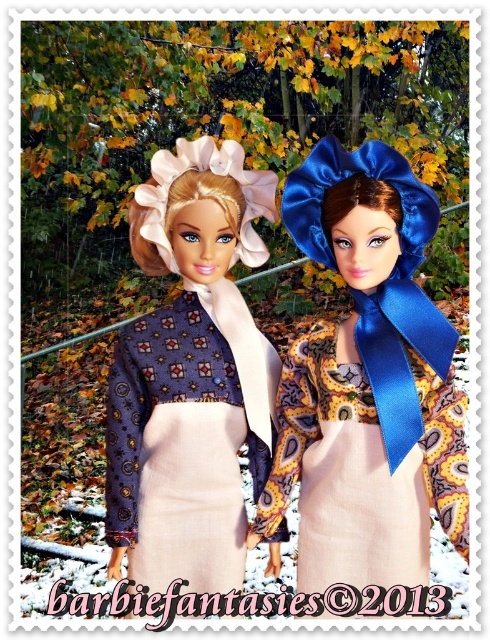
Does blue satin bow at upper right have a larger size compared to matte blue fabric dress at center?

Incorrect, blue satin bow at upper right is not larger than matte blue fabric dress at center.

Identify the location of blue satin bow at upper right. (367, 381).